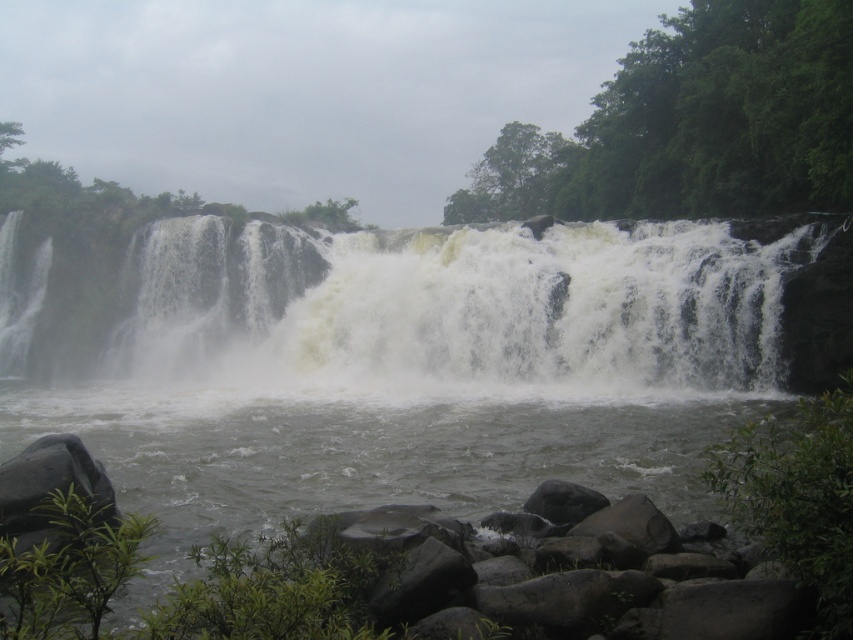
You are standing at the edge of the waterfall and want to place a small weatherproof camera to capture the white frothy water at center. According to the coordinates provided, where should you aim the camera to get the best shot?

The white frothy water at center is located at coordinates point (492, 304), so you should aim the camera at that point to capture it best.

You are standing at the edge of the waterfall and see the white frothy water at center and the gray rock river at center. Which one is positioned to the left side from your viewpoint?

The white frothy water at center is positioned to the left of the gray rock river at center from your viewpoint.